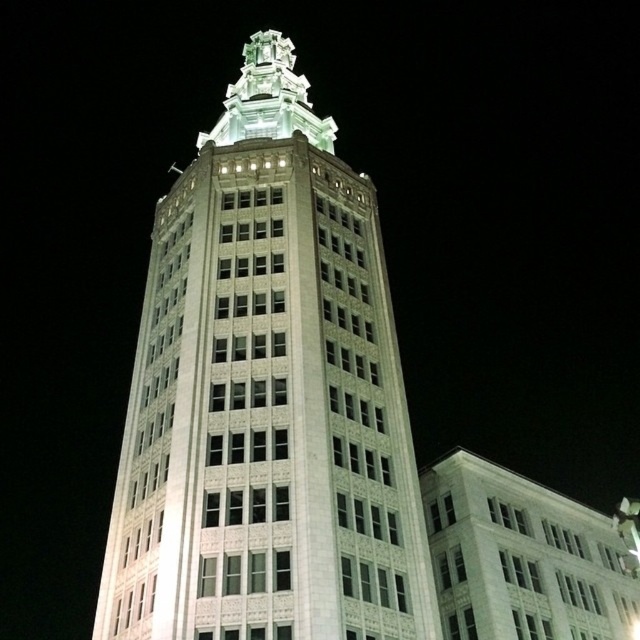
Question: Which object is closer to the camera taking this photo?

Choices:
 (A) white glossy spire at upper center
 (B) white stone tower at center

Answer: (B)

Question: Can you confirm if white stone tower at center is positioned below white glossy spire at upper center?

Choices:
 (A) yes
 (B) no

Answer: (A)

Question: Does white stone tower at center have a larger size compared to white glossy spire at upper center?

Choices:
 (A) yes
 (B) no

Answer: (A)

Question: Which point is farther to the camera?

Choices:
 (A) white stone tower at center
 (B) white glossy spire at upper center

Answer: (B)

Question: Can you confirm if white stone tower at center is wider than white glossy spire at upper center?

Choices:
 (A) yes
 (B) no

Answer: (A)